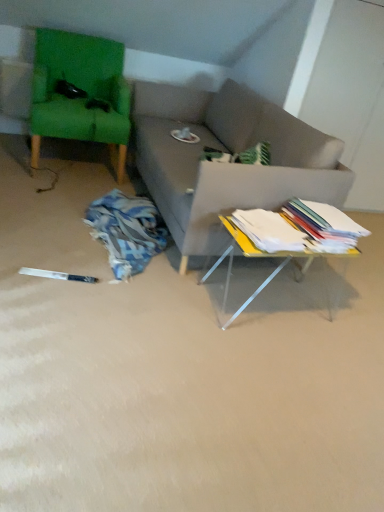
Question: From the image's perspective, is white paper stack at center, arranged as the first book when viewed from the left, below white paper stack at right, positioned as the 1th book in right-to-left order?

Choices:
 (A) no
 (B) yes

Answer: (B)

Question: Is white paper stack at right, positioned as the 1th book in right-to-left order, at the back of white paper stack at center, arranged as the first book when viewed from the left?

Choices:
 (A) yes
 (B) no

Answer: (B)

Question: From the image's perspective, is white paper stack at center, which is counted as the second book, starting from the right, above white paper stack at right, positioned as the 1th book in right-to-left order?

Choices:
 (A) no
 (B) yes

Answer: (A)

Question: Is white paper stack at center, which is counted as the second book, starting from the right, wider than white paper stack at right, the 2th book when ordered from left to right?

Choices:
 (A) yes
 (B) no

Answer: (B)

Question: Does white paper stack at center, which is counted as the second book, starting from the right, lie behind white paper stack at right, the 2th book when ordered from left to right?

Choices:
 (A) yes
 (B) no

Answer: (B)

Question: From the image's perspective, is green fabric swivel chair at upper left above or below white paper stack at center, arranged as the first book when viewed from the left?

Choices:
 (A) above
 (B) below

Answer: (A)

Question: In terms of height, does green fabric swivel chair at upper left look taller or shorter compared to white paper stack at center, which is counted as the second book, starting from the right?

Choices:
 (A) tall
 (B) short

Answer: (A)

Question: Is point (112, 105) positioned closer to the camera than point (283, 245)?

Choices:
 (A) farther
 (B) closer

Answer: (A)

Question: Looking at their shapes, would you say green fabric swivel chair at upper left is wider or thinner than white paper stack at center, which is counted as the second book, starting from the right?

Choices:
 (A) thin
 (B) wide

Answer: (B)

Question: From a real-world perspective, relative to white paper stack at center, arranged as the first book when viewed from the left, is white paper stack at right, positioned as the 1th book in right-to-left order, vertically above or below?

Choices:
 (A) above
 (B) below

Answer: (A)

Question: In the image, is white paper stack at right, positioned as the 1th book in right-to-left order, on the left side or the right side of white paper stack at center, which is counted as the second book, starting from the right?

Choices:
 (A) right
 (B) left

Answer: (A)

Question: Is white paper stack at right, positioned as the 1th book in right-to-left order, wider or thinner than white paper stack at center, arranged as the first book when viewed from the left?

Choices:
 (A) thin
 (B) wide

Answer: (B)

Question: In terms of size, does white paper stack at right, positioned as the 1th book in right-to-left order, appear bigger or smaller than white paper stack at center, which is counted as the second book, starting from the right?

Choices:
 (A) small
 (B) big

Answer: (B)

Question: In the image, is white paper stack at right, positioned as the 1th book in right-to-left order, on the left side or the right side of green fabric swivel chair at upper left?

Choices:
 (A) left
 (B) right

Answer: (B)

Question: In terms of size, does white paper stack at right, positioned as the 1th book in right-to-left order, appear bigger or smaller than green fabric swivel chair at upper left?

Choices:
 (A) small
 (B) big

Answer: (A)